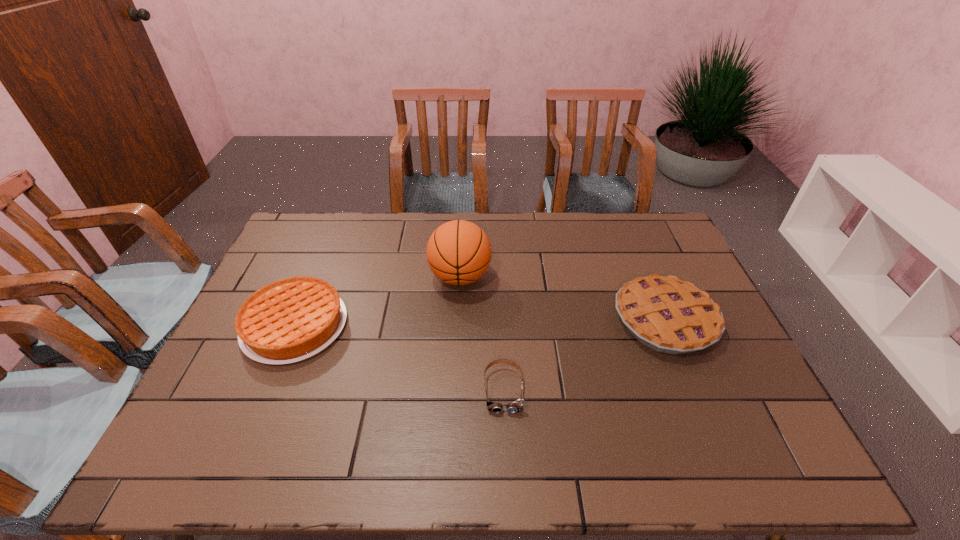
In order to click on the tallest object in this screenshot , I will do `click(458, 252)`.

In order to click on the leftmost object in this screenshot , I will do [290, 320].

This screenshot has height=540, width=960. What are the coordinates of `the right pie` in the screenshot? It's located at tap(668, 315).

Find the location of a particular element. This screenshot has width=960, height=540. goggles is located at coordinates (516, 406).

Where is `vacant space located on the front of the basketball`? The image size is (960, 540). vacant space located on the front of the basketball is located at coordinates (455, 369).

Locate an element on the screen. This screenshot has height=540, width=960. vacant space situated 0.380m on the right of the leftmost object is located at coordinates pos(479,326).

The image size is (960, 540). I want to click on vacant space located 0.370m on the left of the right pie, so click(486, 320).

Find the location of a particular element. This screenshot has width=960, height=540. free point located on the front-facing side of the shortest object is located at coordinates (506, 433).

Locate an element on the screen. The image size is (960, 540). object that is positioned at the left edge is located at coordinates (290, 320).

The height and width of the screenshot is (540, 960). Identify the location of object that is at the right edge. (668, 315).